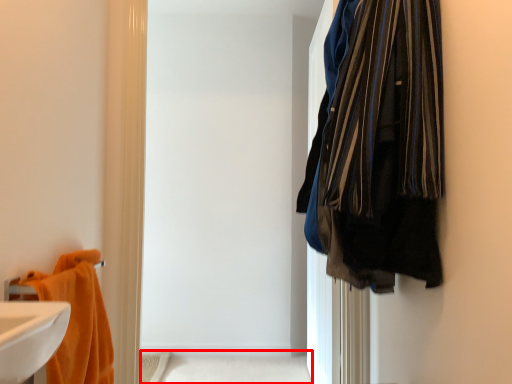
Question: Considering the relative positions of bath (annotated by the red box) and towel in the image provided, where is bath (annotated by the red box) located with respect to the staircase?

Choices:
 (A) right
 (B) left

Answer: (A)